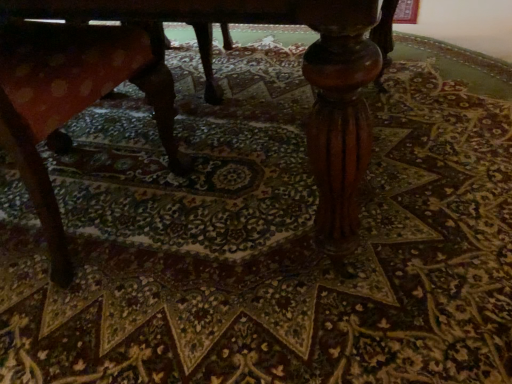
In order to face wooden table at center, should I rotate leftwards or rightwards?

A 19.864 degree turn to the left will do.

Measure the distance between point (346, 155) and camera.

Point (346, 155) is 28.82 inches away from camera.

This screenshot has height=384, width=512. What do you see at coordinates (303, 74) in the screenshot?
I see `wooden table at center` at bounding box center [303, 74].

You are a GUI agent. You are given a task and a screenshot of the screen. Output one action in this format:
    pyautogui.click(x=<x>, y=<y>)
    Task: Click on the wooden table at center
    This screenshot has width=512, height=384.
    Given the screenshot: What is the action you would take?
    pyautogui.click(x=303, y=74)

Image resolution: width=512 pixels, height=384 pixels. Describe the element at coordinates (71, 102) in the screenshot. I see `wooden textured rocking chair at left` at that location.

Where is `wooden textured rocking chair at left`? Image resolution: width=512 pixels, height=384 pixels. wooden textured rocking chair at left is located at coordinates (71, 102).

From the picture: What is the approximate height of wooden textured rocking chair at left?

65.60 centimeters.

The width and height of the screenshot is (512, 384). I want to click on wooden table at center, so pyautogui.click(x=303, y=74).

Which object is positioned more to the right, wooden textured rocking chair at left or wooden table at center?

wooden table at center is more to the right.

Consider the image. Does wooden textured rocking chair at left come behind wooden table at center?

Yes.

Considering the positions of point (46, 37) and point (189, 16), is point (46, 37) closer or farther from the camera than point (189, 16)?

Point (46, 37).

From the image's perspective, is wooden textured rocking chair at left on wooden table at center?

No, from the image's perspective, wooden textured rocking chair at left is not over wooden table at center.

From a real-world perspective, is wooden textured rocking chair at left physically located above or below wooden table at center?

From a real-world perspective, wooden textured rocking chair at left is physically below wooden table at center.

Consider the image. Between wooden textured rocking chair at left and wooden table at center, which one has smaller width?

wooden textured rocking chair at left is thinner.

From their relative heights in the image, would you say wooden textured rocking chair at left is taller or shorter than wooden table at center?

Considering their sizes, wooden textured rocking chair at left has less height than wooden table at center.

Looking at the image, does wooden textured rocking chair at left seem bigger or smaller compared to wooden table at center?

Clearly, wooden textured rocking chair at left is smaller in size than wooden table at center.

Would you say wooden textured rocking chair at left is inside or outside wooden table at center?

wooden textured rocking chair at left is inside wooden table at center.

Would you consider wooden textured rocking chair at left to be distant from wooden table at center?

No.

Is wooden table at center at the back of wooden textured rocking chair at left?

Yes, wooden table at center is at the back of wooden textured rocking chair at left.

The height and width of the screenshot is (384, 512). In order to click on rocking chair that appears on the left of wooden table at center in this screenshot , I will do `click(71, 102)`.

Is wooden table at center at the left side of wooden textured rocking chair at left?

In fact, wooden table at center is to the right of wooden textured rocking chair at left.

Is wooden table at center in front of wooden textured rocking chair at left?

That is True.

Which is behind, point (351, 51) or point (36, 99)?

Positioned behind is point (36, 99).

From the image's perspective, is wooden table at center located above or below wooden textured rocking chair at left?

From the image's perspective, wooden table at center appears above wooden textured rocking chair at left.

From a real-world perspective, is wooden table at center beneath wooden textured rocking chair at left?

No.

Does wooden table at center have a greater width compared to wooden textured rocking chair at left?

Yes, wooden table at center is wider than wooden textured rocking chair at left.

Which of these two, wooden table at center or wooden textured rocking chair at left, stands taller?

With more height is wooden table at center.

Considering the sizes of objects wooden table at center and wooden textured rocking chair at left in the image provided, who is smaller, wooden table at center or wooden textured rocking chair at left?

With smaller size is wooden textured rocking chair at left.

Would you say wooden table at center is outside wooden textured rocking chair at left?

wooden table at center is positioned outside wooden textured rocking chair at left.

Are wooden table at center and wooden textured rocking chair at left far apart?

wooden table at center is near wooden textured rocking chair at left, not far away.

Is wooden table at center facing towards wooden textured rocking chair at left?

Yes, wooden table at center faces towards wooden textured rocking chair at left.

How different are the orientations of wooden table at center and wooden textured rocking chair at left in degrees?

wooden table at center and wooden textured rocking chair at left are facing 176 degrees away from each other.

Locate an element on the screen. The image size is (512, 384). table on the right of the wooden textured rocking chair at left is located at coordinates (303, 74).

At what (x,y) coordinates should I click in order to perform the action: click on table lying on the right of wooden textured rocking chair at left. Please return your answer as a coordinate pair (x, y). The width and height of the screenshot is (512, 384). Looking at the image, I should click on (303, 74).

The height and width of the screenshot is (384, 512). In order to click on table lying above the wooden textured rocking chair at left (from the image's perspective) in this screenshot , I will do `click(303, 74)`.